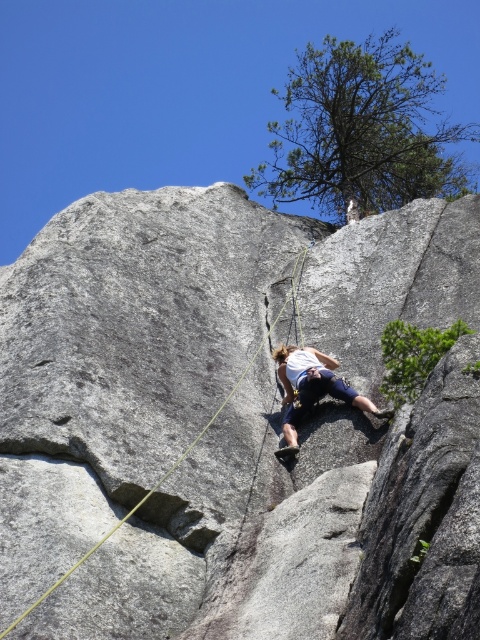
Which of these two, gray rock at center or white fabric climbing harness at center, stands shorter?

Standing shorter between the two is white fabric climbing harness at center.

Does gray rock at center have a smaller size compared to white fabric climbing harness at center?

No.

Which is in front, point (218, 330) or point (317, 392)?

Point (317, 392) is in front.

Locate an element on the screen. gray rock at center is located at coordinates (232, 422).